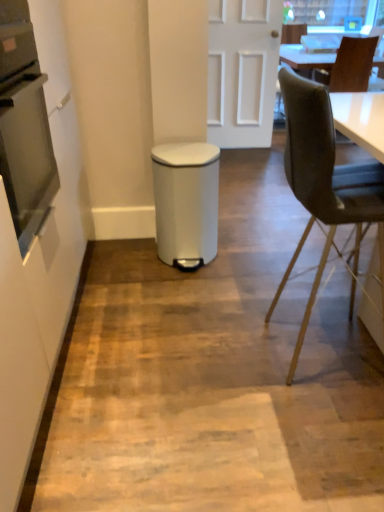
Question: Can you see stainless steel oven at left touching white matte door at center?

Choices:
 (A) yes
 (B) no

Answer: (B)

Question: Is stainless steel oven at left further to camera compared to white matte door at center?

Choices:
 (A) yes
 (B) no

Answer: (B)

Question: Is stainless steel oven at left wider than white matte door at center?

Choices:
 (A) no
 (B) yes

Answer: (B)

Question: Is stainless steel oven at left in front of white matte door at center?

Choices:
 (A) no
 (B) yes

Answer: (B)

Question: Is stainless steel oven at left oriented towards white matte door at center?

Choices:
 (A) no
 (B) yes

Answer: (A)

Question: Considering their positions, is white matte door at center located in front of or behind white matte trash can at center?

Choices:
 (A) behind
 (B) front

Answer: (A)

Question: Considering the positions of point (251, 96) and point (44, 368), is point (251, 96) closer or farther from the camera than point (44, 368)?

Choices:
 (A) farther
 (B) closer

Answer: (A)

Question: From a real-world perspective, is white matte door at center above or below white matte trash can at center?

Choices:
 (A) above
 (B) below

Answer: (A)

Question: Is white matte door at center situated inside white matte trash can at center or outside?

Choices:
 (A) inside
 (B) outside

Answer: (B)

Question: Considering the positions of point (228, 67) and point (349, 76), is point (228, 67) closer or farther from the camera than point (349, 76)?

Choices:
 (A) closer
 (B) farther

Answer: (A)

Question: Would you say white matte door at center is inside or outside brown leather chair at upper right, acting as the 1th chair starting from the back?

Choices:
 (A) inside
 (B) outside

Answer: (B)

Question: Based on their positions, is white matte door at center located to the left or right of brown leather chair at upper right, placed as the second chair when sorted from front to back?

Choices:
 (A) left
 (B) right

Answer: (A)

Question: From the image's perspective, is white matte door at center above or below brown leather chair at upper right, placed as the second chair when sorted from bottom to top?

Choices:
 (A) below
 (B) above

Answer: (A)

Question: Considering their positions, is stainless steel oven at left located in front of or behind white plastic waste bin at center?

Choices:
 (A) front
 (B) behind

Answer: (A)

Question: Would you say stainless steel oven at left is to the left or to the right of white plastic waste bin at center in the picture?

Choices:
 (A) left
 (B) right

Answer: (A)